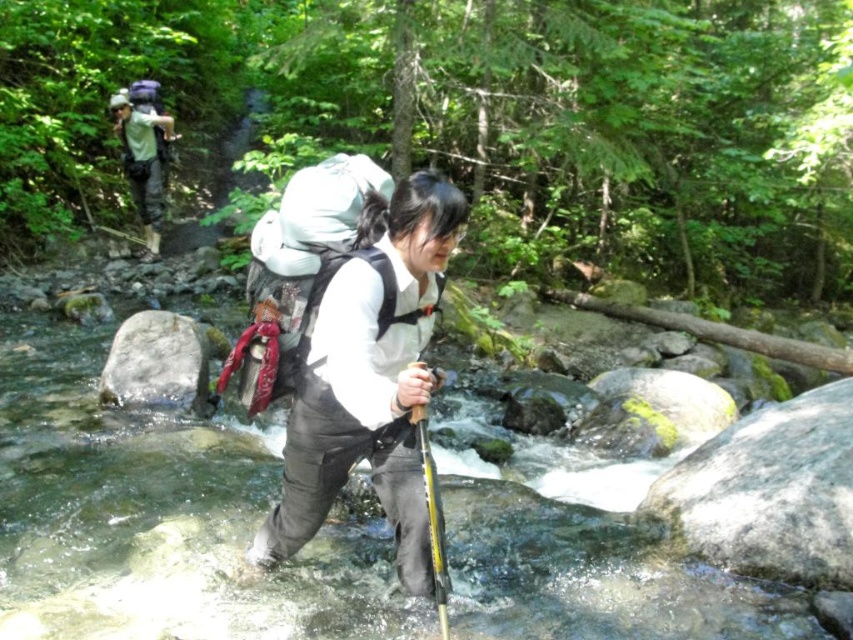
Question: Based on their relative distances, which object is nearer to the white matte backpack at center?

Choices:
 (A) gray rough rock at center
 (B) matte gray backpack at center

Answer: (B)

Question: Which point is closer to the camera taking this photo?

Choices:
 (A) (201, 349)
 (B) (318, 240)
 (C) (376, 243)

Answer: (C)

Question: Which point is closer to the camera?

Choices:
 (A) (422, 339)
 (B) (289, 355)
 (C) (165, 326)
 (D) (131, 161)

Answer: (A)

Question: Does matte gray backpack at center have a lesser width compared to matte gray backpack at upper left?

Choices:
 (A) yes
 (B) no

Answer: (A)

Question: In this image, where is white matte backpack at center located relative to gray rough rock at center?

Choices:
 (A) right
 (B) left

Answer: (A)

Question: Can you confirm if white matte backpack at center is positioned above matte gray backpack at upper left?

Choices:
 (A) no
 (B) yes

Answer: (A)